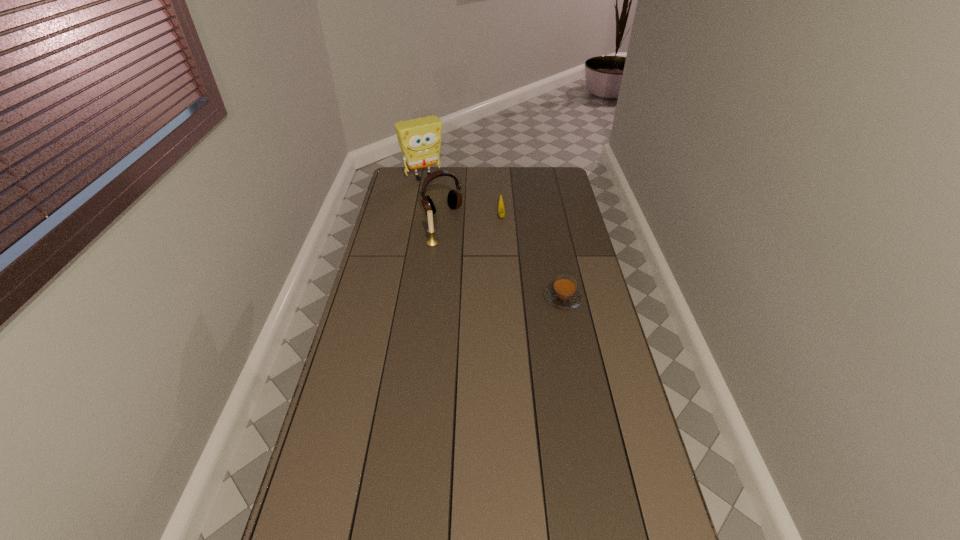
Where is `free region located at the stem of the banana`? This screenshot has height=540, width=960. free region located at the stem of the banana is located at coordinates (505, 260).

I want to click on vacant space situated at the stem of the banana, so click(505, 263).

This screenshot has width=960, height=540. Find the location of `vacant space located 0.160m at the stem of the banana`. vacant space located 0.160m at the stem of the banana is located at coordinates (504, 248).

Identify the location of free space located on the face of the farthest object. (441, 195).

Identify the location of free location located 0.390m on the face of the farthest object. [464, 223].

Where is `free spot located on the face of the farthest object`? free spot located on the face of the farthest object is located at coordinates (450, 206).

In order to click on vacant point located 0.140m on the ear pads of the second tallest object in this screenshot , I will do `click(461, 235)`.

Where is `free space located on the ear pads of the second tallest object`? This screenshot has width=960, height=540. free space located on the ear pads of the second tallest object is located at coordinates (456, 228).

This screenshot has height=540, width=960. What are the coordinates of `vacant area situated 0.190m on the ear pads of the second tallest object` in the screenshot? It's located at (465, 241).

The image size is (960, 540). What are the coordinates of `object that is at the far edge` in the screenshot? It's located at (419, 139).